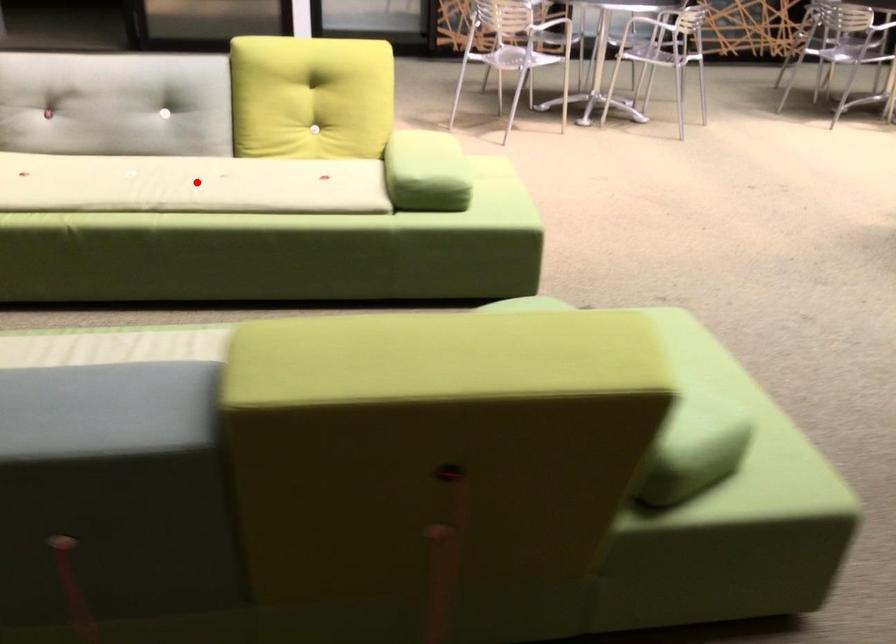
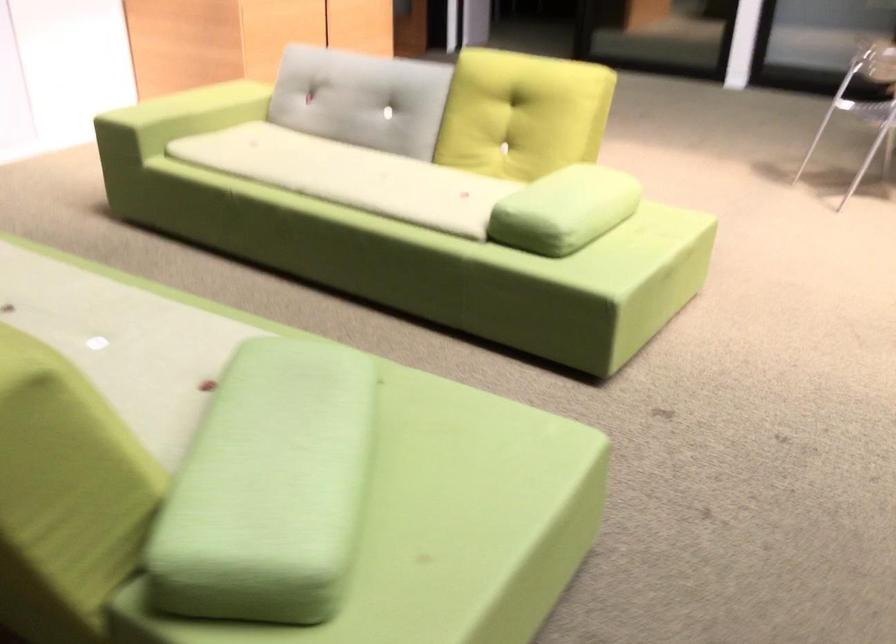
Question: I am providing you with two images of the same scene from different viewpoints. A red point is marked on the first image. At the location where the point appears in image 1, is it still visible in image 2?

Choices:
 (A) Yes
 (B) No

Answer: (A)